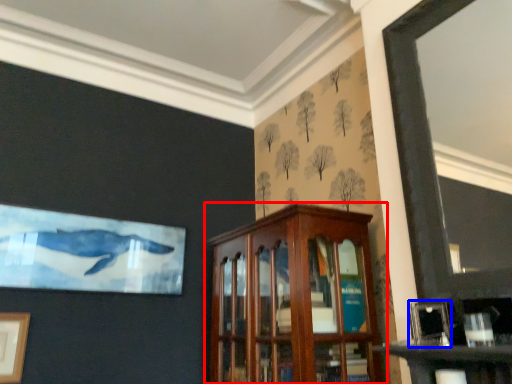
Question: Which object is closer to the camera taking this photo, cabinetry (highlighted by a red box) or picture frame (highlighted by a blue box)?

Choices:
 (A) cabinetry
 (B) picture frame

Answer: (B)